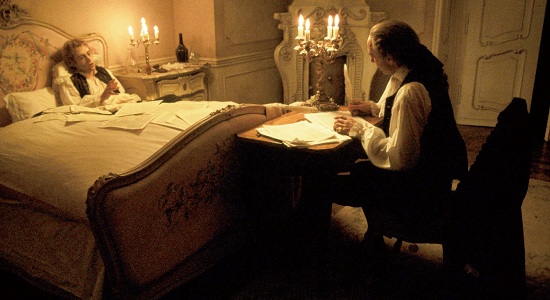
Identify the location of papers. This screenshot has height=300, width=550. (302, 122), (318, 143), (324, 124).